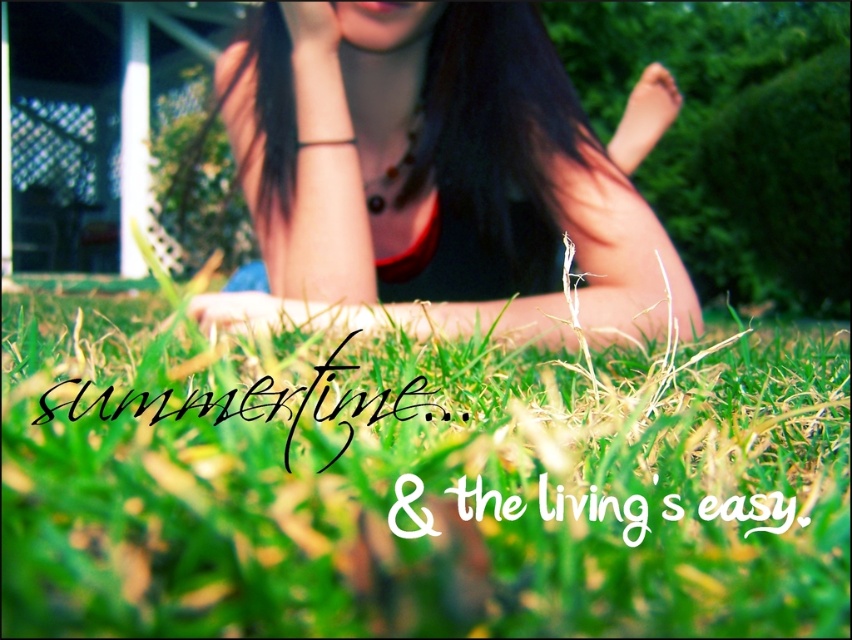
Who is higher up, matte red tank top at center or matte skin hand at upper center?

matte skin hand at upper center is above.

Can you confirm if matte red tank top at center is bigger than matte skin hand at upper center?

Correct, matte red tank top at center is larger in size than matte skin hand at upper center.

Does point (303, 189) come closer to viewer compared to point (298, 4)?

No, it is behind (298, 4).

I want to click on matte red tank top at center, so click(x=439, y=180).

Does green grass at center have a lesser width compared to matte skin hand at upper center?

No.

Does point (378, 524) come closer to viewer compared to point (332, 33)?

Yes, it is in front of point (332, 33).

Where is `green grass at center`? This screenshot has height=640, width=852. green grass at center is located at coordinates (415, 483).

Is green grass at center below matte red tank top at center?

Yes, green grass at center is below matte red tank top at center.

Does green grass at center appear over matte red tank top at center?

No.

Is point (493, 570) in front of point (315, 68)?

Yes, it is.

Identify the location of green grass at center. (415, 483).